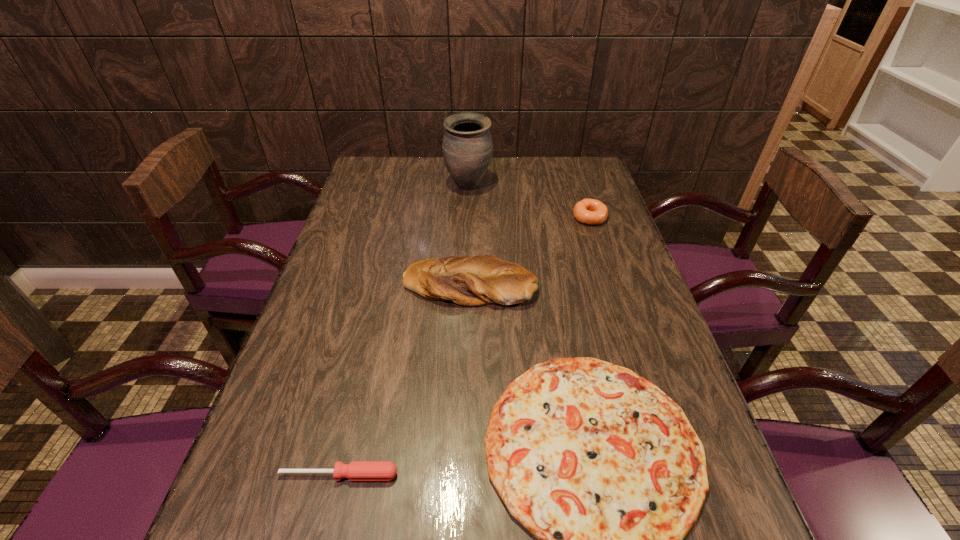
Locate an element on the screen. The width and height of the screenshot is (960, 540). urn is located at coordinates (467, 147).

Identify the location of the tallest object. This screenshot has height=540, width=960. (467, 147).

Where is `the fourth shortest object`? Image resolution: width=960 pixels, height=540 pixels. the fourth shortest object is located at coordinates (483, 279).

Locate an element on the screen. The height and width of the screenshot is (540, 960). bread is located at coordinates (483, 279).

Identify the location of doughnut. This screenshot has width=960, height=540. [588, 211].

What are the coordinates of `the second farthest object` in the screenshot? It's located at (588, 211).

What are the coordinates of `screwdriver` in the screenshot? It's located at (356, 470).

In order to click on vacant region located on the front of the urn in this screenshot , I will do `click(465, 272)`.

At what (x,y) coordinates should I click in order to perform the action: click on vacant region located 0.220m on the right of the third farthest object. Please return your answer as a coordinate pair (x, y). This screenshot has height=540, width=960. Looking at the image, I should click on (620, 285).

At what (x,y) coordinates should I click in order to perform the action: click on blank area located on the back of the third shortest object. Please return your answer as a coordinate pair (x, y). The height and width of the screenshot is (540, 960). Looking at the image, I should click on (581, 190).